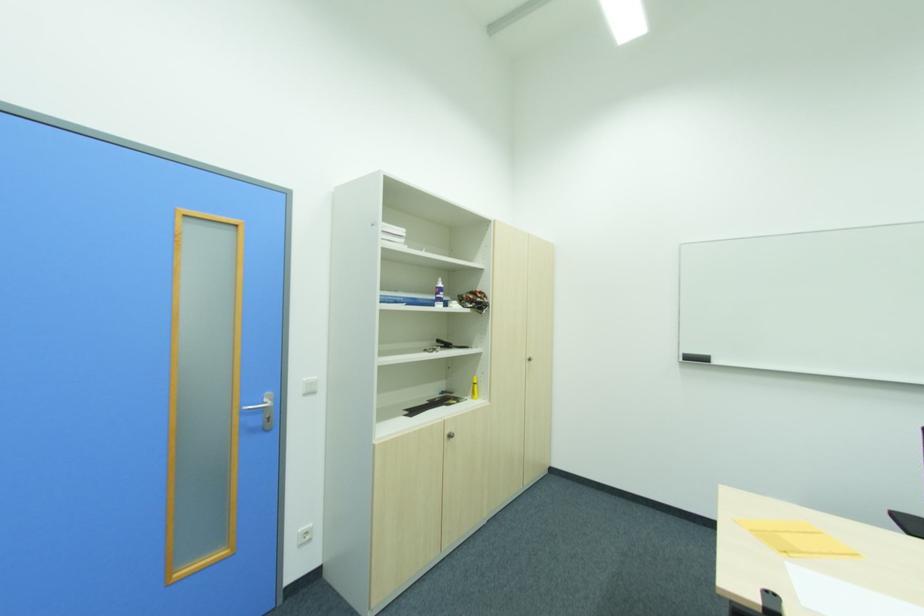
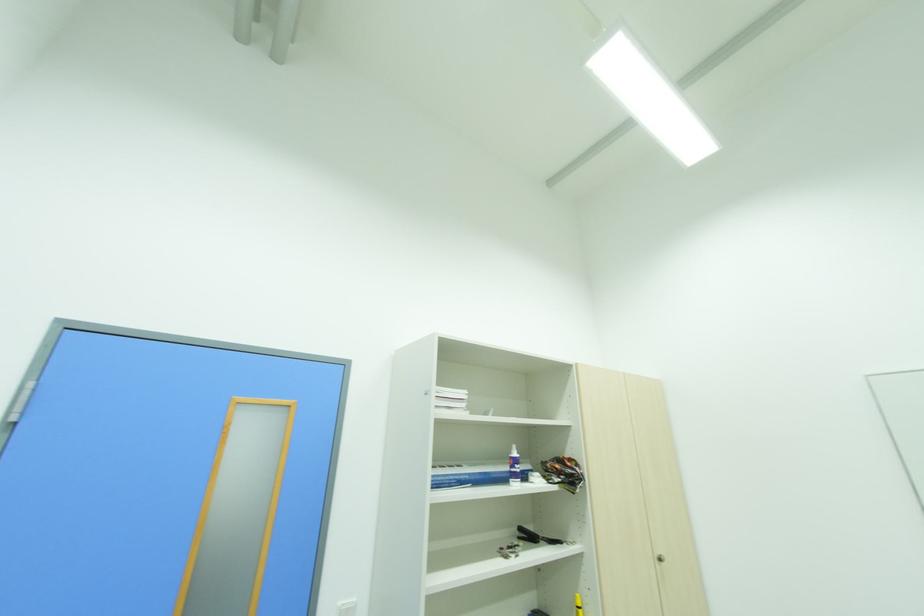
Find the pixel in the second image that matches point (444, 285) in the first image.

(517, 455)